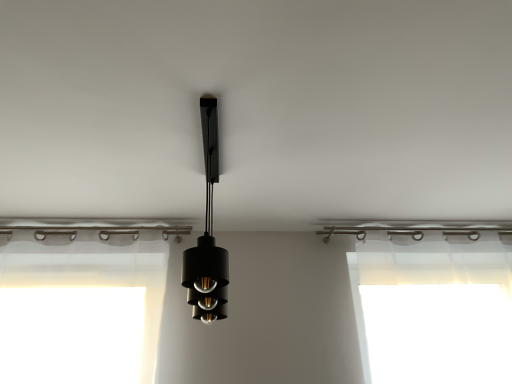
Question: From the image's perspective, is black matte pendant light at center below transparent plastic at right?

Choices:
 (A) no
 (B) yes

Answer: (A)

Question: Considering the relative sizes of black matte pendant light at center and transparent plastic at right in the image provided, is black matte pendant light at center bigger than transparent plastic at right?

Choices:
 (A) yes
 (B) no

Answer: (B)

Question: Is black matte pendant light at center at the right side of transparent plastic at right?

Choices:
 (A) no
 (B) yes

Answer: (A)

Question: Considering the relative sizes of black matte pendant light at center and transparent plastic at right in the image provided, is black matte pendant light at center shorter than transparent plastic at right?

Choices:
 (A) yes
 (B) no

Answer: (A)

Question: Does black matte pendant light at center turn towards transparent plastic at right?

Choices:
 (A) yes
 (B) no

Answer: (B)

Question: Would you say black matte pendant light at center contains transparent plastic at right?

Choices:
 (A) no
 (B) yes

Answer: (A)

Question: Is transparent plastic at right shorter than black matte pendant light at center?

Choices:
 (A) yes
 (B) no

Answer: (B)

Question: Can you confirm if transparent plastic at right is taller than black matte pendant light at center?

Choices:
 (A) yes
 (B) no

Answer: (A)

Question: Considering the relative positions of transparent plastic at right and black matte pendant light at center in the image provided, is transparent plastic at right to the right of black matte pendant light at center from the viewer's perspective?

Choices:
 (A) no
 (B) yes

Answer: (B)

Question: Considering the relative sizes of transparent plastic at right and black matte pendant light at center in the image provided, is transparent plastic at right smaller than black matte pendant light at center?

Choices:
 (A) no
 (B) yes

Answer: (A)

Question: From a real-world perspective, is transparent plastic at right beneath black matte pendant light at center?

Choices:
 (A) yes
 (B) no

Answer: (A)

Question: Is transparent plastic at right at the left side of black matte pendant light at center?

Choices:
 (A) no
 (B) yes

Answer: (A)

Question: Considering their positions, is transparent plastic at right located in front of or behind black matte pendant light at center?

Choices:
 (A) behind
 (B) front

Answer: (A)